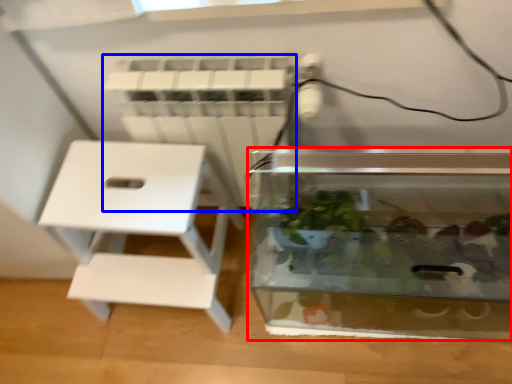
Question: Which object is further to the camera taking this photo, glass box (highlighted by a red box) or radiator (highlighted by a blue box)?

Choices:
 (A) glass box
 (B) radiator

Answer: (B)